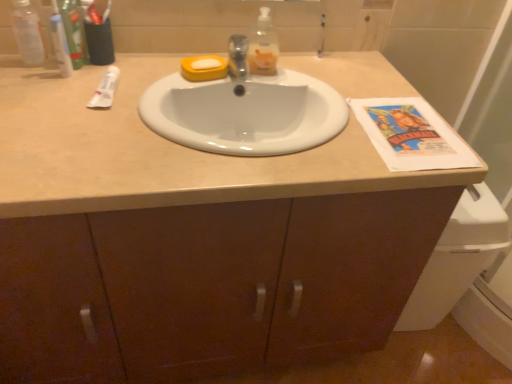
Where is `free space in front of translucent plastic toothbrush holder at upper left, positioned as the second toiletry in left-to-right order`? free space in front of translucent plastic toothbrush holder at upper left, positioned as the second toiletry in left-to-right order is located at coordinates (73, 93).